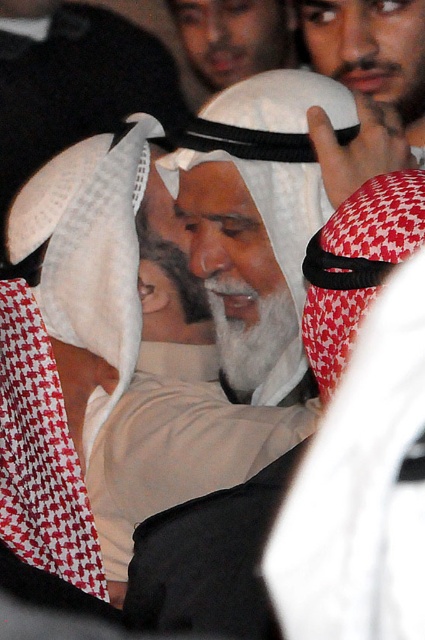
Can you confirm if white matte headscarf at upper center is bigger than white matte keffiyeh at center?

Actually, white matte headscarf at upper center might be smaller than white matte keffiyeh at center.

Can you confirm if white matte headscarf at upper center is smaller than white matte keffiyeh at center?

Correct, white matte headscarf at upper center occupies less space than white matte keffiyeh at center.

Is point (339, 42) positioned in front of point (282, 19)?

Yes, point (339, 42) is in front of point (282, 19).

At what (x,y) coordinates should I click in order to perform the action: click on white matte headscarf at upper center. Please return your answer as a coordinate pair (x, y). Image resolution: width=425 pixels, height=640 pixels. Looking at the image, I should click on (371, 51).